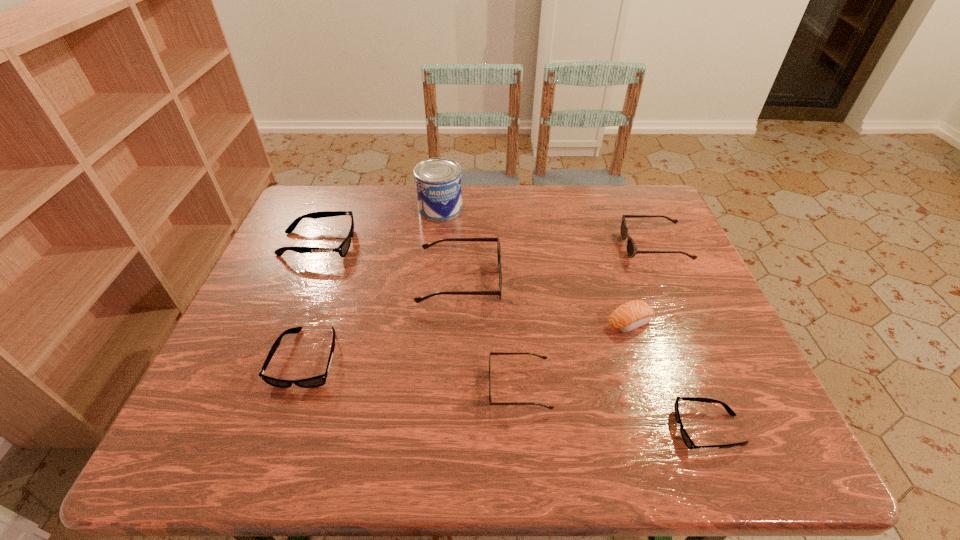
This screenshot has width=960, height=540. Find the location of `vacant space that is in between the shortest sunglasses and the second smallest black sunglasses`. vacant space that is in between the shortest sunglasses and the second smallest black sunglasses is located at coordinates (508, 394).

Where is `free area in between the smallest brown sunglasses and the rightmost brown sunglasses`? This screenshot has height=540, width=960. free area in between the smallest brown sunglasses and the rightmost brown sunglasses is located at coordinates (587, 317).

I want to click on vacant area between the biggest black sunglasses and the second biggest black sunglasses, so click(313, 301).

Identify the location of vacant space that's between the can and the second farthest black sunglasses. The image size is (960, 540). (374, 283).

Where is `free space between the second biggest brown sunglasses and the smallest black sunglasses`? free space between the second biggest brown sunglasses and the smallest black sunglasses is located at coordinates (682, 338).

The image size is (960, 540). I want to click on unoccupied area between the can and the smallest brown sunglasses, so click(x=480, y=298).

The width and height of the screenshot is (960, 540). Find the location of `unoccupied area between the nearest brown sunglasses and the farthest object`. unoccupied area between the nearest brown sunglasses and the farthest object is located at coordinates (480, 298).

Select which object is the sixth closest to the smallest black sunglasses. Please provide its 2D coordinates. Your answer should be formatted as a tuple, i.e. [(x, y)], where the tuple contains the x and y coordinates of a point satisfying the conditions above.

[(438, 183)]

This screenshot has width=960, height=540. What are the coordinates of `the sixth closest object relative to the shortest object` in the screenshot? It's located at (x=438, y=183).

What are the coordinates of `sunglasses that is the third nearest to the smallest brown sunglasses` in the screenshot? It's located at (317, 381).